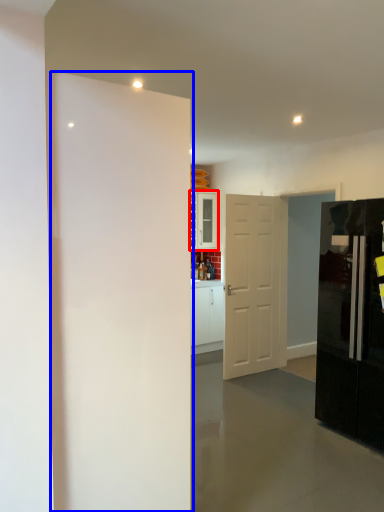
Question: Which point is further to the camera, cabinetry (highlighted by a red box) or door (highlighted by a blue box)?

Choices:
 (A) cabinetry
 (B) door

Answer: (A)